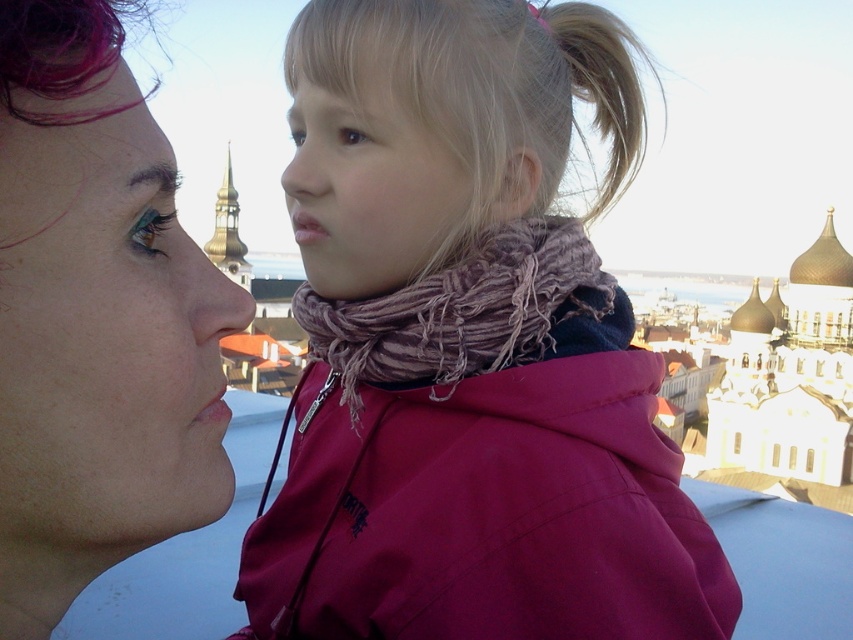
Who is positioned more to the right, pink fabric scarf at center or matte pink scarf at upper right?

From the viewer's perspective, pink fabric scarf at center appears more on the right side.

Which is behind, point (503, 476) or point (96, 317)?

Point (503, 476)

Where is `pink fabric scarf at center`? pink fabric scarf at center is located at coordinates (468, 348).

This screenshot has height=640, width=853. Find the location of `pink fabric scarf at center`. pink fabric scarf at center is located at coordinates click(x=468, y=348).

Which is above, pink fabric scarf at center or woolen scarf at center?

Positioned higher is pink fabric scarf at center.

Can you confirm if pink fabric scarf at center is thinner than woolen scarf at center?

No.

Does point (425, 442) lie in front of point (577, 244)?

Yes.

What are the coordinates of `pink fabric scarf at center` in the screenshot? It's located at (468, 348).

Which is above, woolen scarf at center or blonde hair at upper center?

Positioned higher is blonde hair at upper center.

Does point (488, 237) come behind point (556, 56)?

No, it is in front of (556, 56).

Locate an element on the screen. The image size is (853, 640). woolen scarf at center is located at coordinates (461, 312).